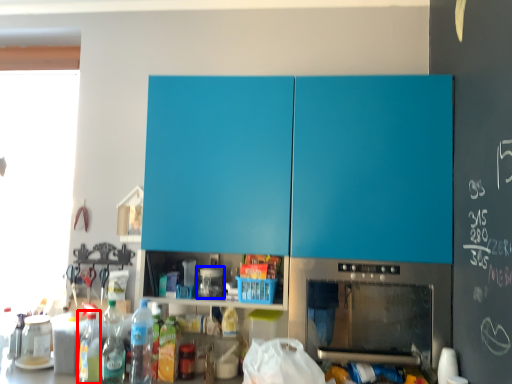
Question: Which object is further to the camera taking this photo, bottle (highlighted by a red box) or appliance (highlighted by a blue box)?

Choices:
 (A) bottle
 (B) appliance

Answer: (B)